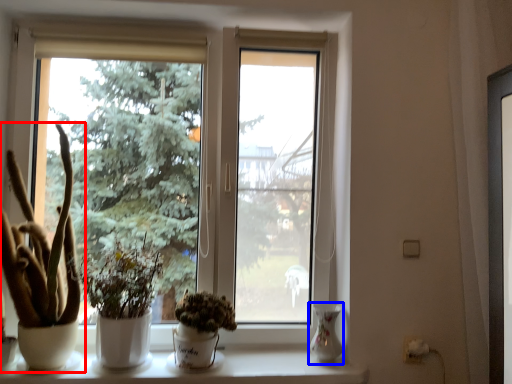
Question: Among these objects, which one is nearest to the camera, houseplant (highlighted by a red box) or glass vase (highlighted by a blue box)?

Choices:
 (A) houseplant
 (B) glass vase

Answer: (A)